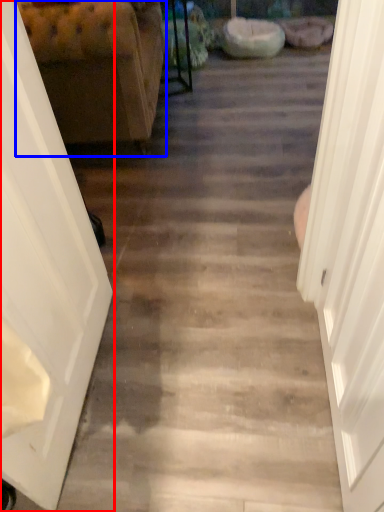
Question: Which of the following is the farthest to the observer, door (highlighted by a red box) or furniture (highlighted by a blue box)?

Choices:
 (A) door
 (B) furniture

Answer: (B)